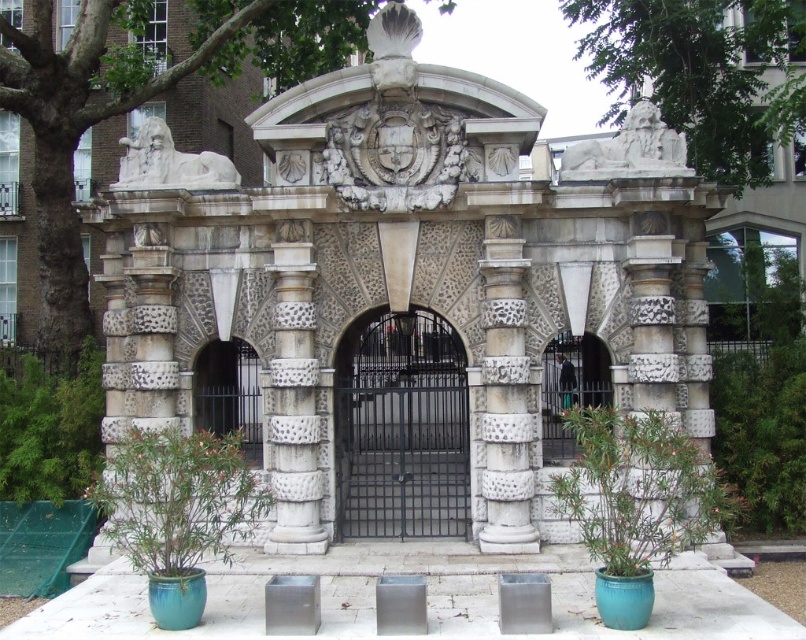
Question: Can you confirm if green glossy plant at lower left is smaller than white stone lion at upper left?

Choices:
 (A) yes
 (B) no

Answer: (A)

Question: Which object appears closest to the camera in this image?

Choices:
 (A) black wrought iron gate at center
 (B) green leafy plant at lower left

Answer: (A)

Question: Does white stone column at center appear on the right side of black metal gate at center?

Choices:
 (A) yes
 (B) no

Answer: (A)

Question: Estimate the real-world distances between objects in this image. Which object is farther from the white stone column at center?

Choices:
 (A) green leafy plant at center
 (B) white stone lion at upper left
 (C) white textured column at center
 (D) speckled stone column at center

Answer: (B)

Question: Does speckled stone column at center have a smaller size compared to green leafy plant at lower left?

Choices:
 (A) no
 (B) yes

Answer: (B)

Question: Estimate the real-world distances between objects in this image. Which object is closer to the white textured column at center?

Choices:
 (A) green leafy plant at lower left
 (B) speckled stone column at center

Answer: (B)